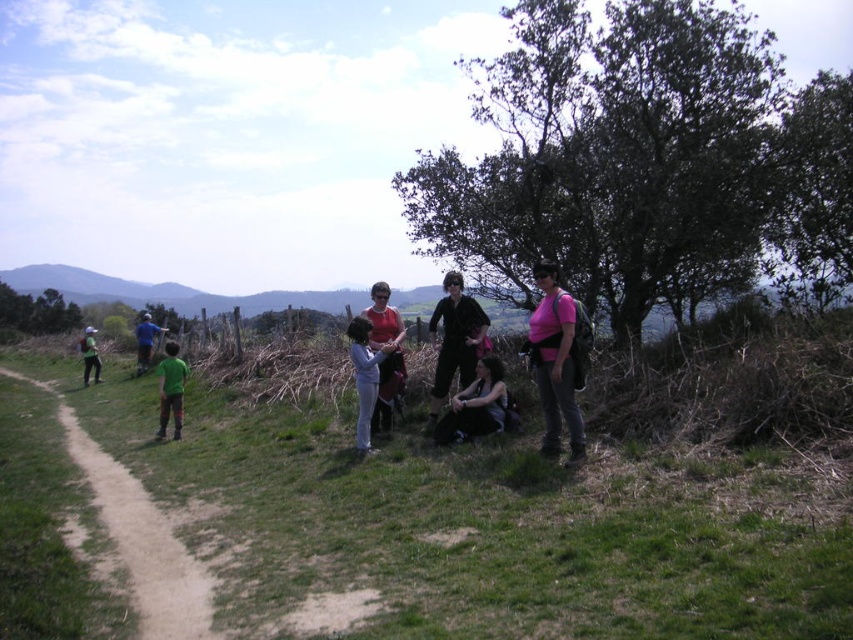
Measure the distance between point (x=363, y=440) and camera.

A distance of 27.07 feet exists between point (x=363, y=440) and camera.

Can you confirm if light blue fabric at center is shorter than blue fabric shirt at left?

Incorrect, light blue fabric at center's height does not fall short of blue fabric shirt at left's.

Where is `light blue fabric at center`? Image resolution: width=853 pixels, height=640 pixels. light blue fabric at center is located at coordinates (364, 376).

Find the location of a particular element. light blue fabric at center is located at coordinates (364, 376).

Can you confirm if pink fabric group at center is wider than blue fabric shirt at left?

Yes.

Who is higher up, pink fabric group at center or blue fabric shirt at left?

blue fabric shirt at left is higher up.

Between point (476, 344) and point (138, 362), which one is positioned behind?

Positioned behind is point (138, 362).

I want to click on pink fabric group at center, so (556, 362).

Is black leather jacket at center wider than green fabric jacket at left?

No.

In the scene shown: Can you confirm if black leather jacket at center is positioned to the left of green fabric jacket at left?

No, black leather jacket at center is not to the left of green fabric jacket at left.

Where is `black leather jacket at center`? The width and height of the screenshot is (853, 640). black leather jacket at center is located at coordinates (456, 339).

The image size is (853, 640). Identify the location of black leather jacket at center. (456, 339).